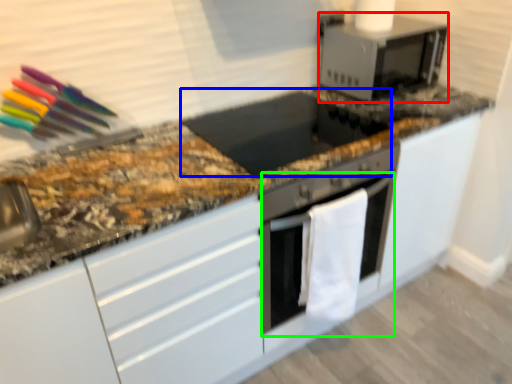
Question: Which object is positioned closest to microwave oven (highlighted by a red box)? Select from appliance (highlighted by a blue box) and oven (highlighted by a green box).

Choices:
 (A) appliance
 (B) oven

Answer: (A)